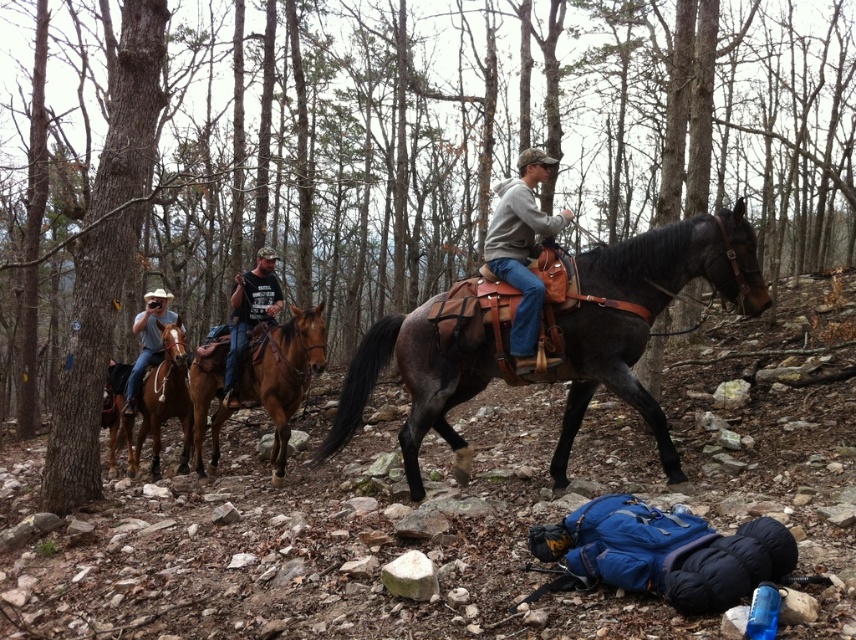
Does brown leather saddle at center have a greater width compared to brushed metal horse at center?

Indeed, brown leather saddle at center has a greater width compared to brushed metal horse at center.

Which is behind, point (283, 326) or point (253, 269)?

The point (253, 269) is more distant.

Which is in front, point (308, 323) or point (272, 314)?

Point (308, 323) is in front.

At what (x,y) coordinates should I click in order to perform the action: click on brown leather saddle at center. Please return your answer as a coordinate pair (x, y). This screenshot has height=640, width=856. Looking at the image, I should click on (282, 372).

What do you see at coordinates (522, 250) in the screenshot? This screenshot has height=640, width=856. I see `gray matte hoodie at center` at bounding box center [522, 250].

Between point (525, 205) and point (135, 452), which one is positioned behind?

The point (135, 452) is more distant.

From the picture: Who is more forward, [525,321] or [169,408]?

Point [525,321]

Locate an element on the screen. gray matte hoodie at center is located at coordinates (522, 250).

The height and width of the screenshot is (640, 856). What are the coordinates of `shiny brown horse at center` in the screenshot? It's located at (645, 314).

Which is behind, point (670, 470) or point (516, 221)?

Positioned behind is point (516, 221).

In order to click on shiny brown horse at center in this screenshot , I will do `click(645, 314)`.